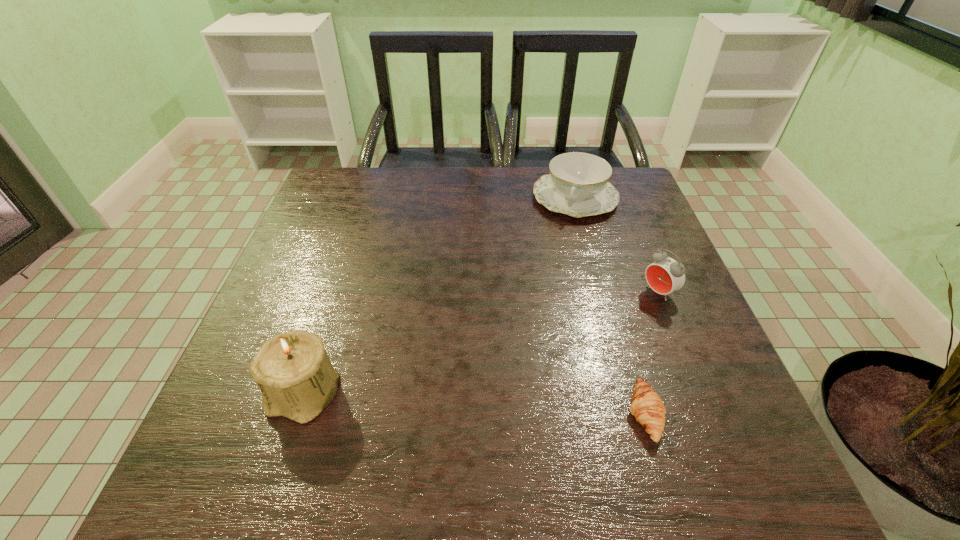
Point out which object is positioned as the nearest to the alarm clock. Please provide its 2D coordinates. Your answer should be formatted as a tuple, i.e. [(x, y)], where the tuple contains the x and y coordinates of a point satisfying the conditions above.

[(646, 405)]

Select which object is the third closest to the candle_holder. Please provide its 2D coordinates. Your answer should be formatted as a tuple, i.e. [(x, y)], where the tuple contains the x and y coordinates of a point satisfying the conditions above.

[(666, 275)]

This screenshot has height=540, width=960. In order to click on free spot that satisfies the following two spatial constraints: 1. on the front side of the farthest object; 2. on the left side of the third nearest object in this screenshot , I will do `click(601, 292)`.

The width and height of the screenshot is (960, 540). I want to click on free point that satisfies the following two spatial constraints: 1. on the front side of the third nearest object; 2. on the right side of the farthest object, so click(x=601, y=292).